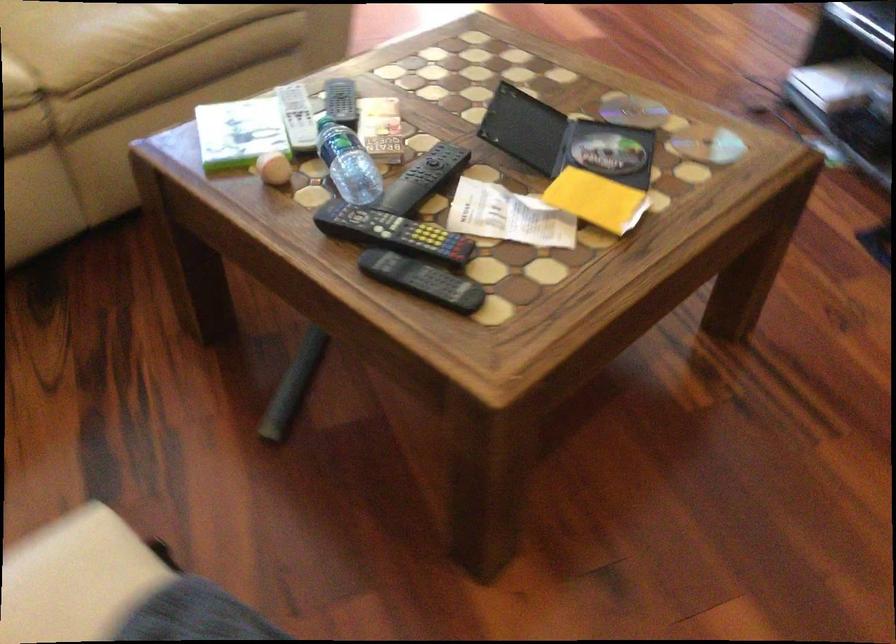
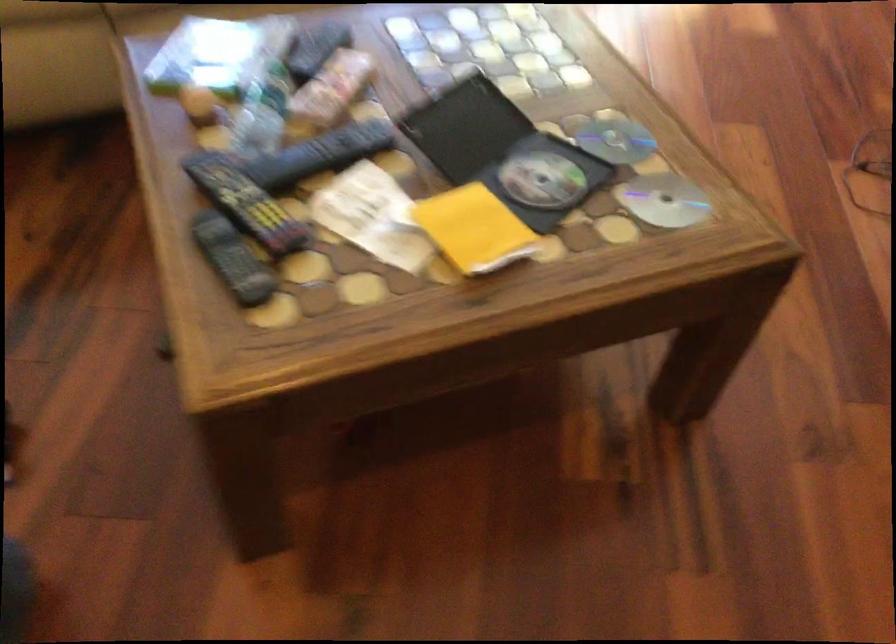
Where in the second image is the point corresponding to pixel 424 178 from the first image?

(320, 154)